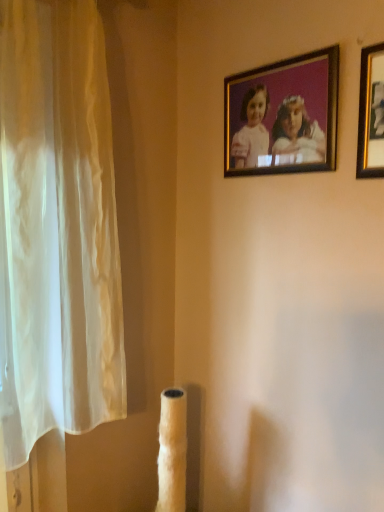
Question: Is gold-framed photo at upper center, the first picture frame when ordered from left to right, looking in the opposite direction of gold-framed picture at upper right, which ranks as the 2th picture frame in back-to-front order?

Choices:
 (A) yes
 (B) no

Answer: (B)

Question: Is gold-framed photo at upper center, the first picture frame when ordered from left to right, shorter than gold-framed picture at upper right, which is counted as the 1th picture frame, starting from the front?

Choices:
 (A) yes
 (B) no

Answer: (A)

Question: Considering the relative positions of gold-framed photo at upper center, the first picture frame when ordered from left to right, and gold-framed picture at upper right, acting as the first picture frame starting from the right, in the image provided, is gold-framed photo at upper center, the first picture frame when ordered from left to right, behind gold-framed picture at upper right, acting as the first picture frame starting from the right,?

Choices:
 (A) yes
 (B) no

Answer: (A)

Question: From the image's perspective, is gold-framed photo at upper center, marked as the second picture frame in a front-to-back arrangement, on gold-framed picture at upper right, which ranks as the 2th picture frame in back-to-front order?

Choices:
 (A) yes
 (B) no

Answer: (A)

Question: Does gold-framed photo at upper center, the 2th picture frame from the right, have a larger size compared to gold-framed picture at upper right, which appears as the 2th picture frame when viewed from the left?

Choices:
 (A) no
 (B) yes

Answer: (B)

Question: From the image's perspective, is gold-framed photo at upper center, marked as the second picture frame in a front-to-back arrangement, located beneath gold-framed picture at upper right, which ranks as the 2th picture frame in back-to-front order?

Choices:
 (A) yes
 (B) no

Answer: (B)

Question: Is gold-framed picture at upper right, which ranks as the 2th picture frame in back-to-front order, next to gold-framed photo at upper center, marked as the second picture frame in a front-to-back arrangement?

Choices:
 (A) yes
 (B) no

Answer: (B)

Question: Does gold-framed picture at upper right, acting as the first picture frame starting from the right, have a larger size compared to gold-framed photo at upper center, the 2th picture frame from the right?

Choices:
 (A) yes
 (B) no

Answer: (B)

Question: Considering the relative positions of gold-framed picture at upper right, acting as the first picture frame starting from the right, and gold-framed photo at upper center, the 2th picture frame from the right, in the image provided, is gold-framed picture at upper right, acting as the first picture frame starting from the right, in front of gold-framed photo at upper center, the 2th picture frame from the right,?

Choices:
 (A) yes
 (B) no

Answer: (A)

Question: Is gold-framed picture at upper right, which is counted as the 1th picture frame, starting from the front, smaller than gold-framed photo at upper center, marked as the second picture frame in a front-to-back arrangement?

Choices:
 (A) no
 (B) yes

Answer: (B)

Question: Is gold-framed picture at upper right, which appears as the 2th picture frame when viewed from the left, far from gold-framed photo at upper center, the first picture frame when ordered from left to right?

Choices:
 (A) yes
 (B) no

Answer: (B)

Question: From the image's perspective, is gold-framed picture at upper right, which ranks as the 2th picture frame in back-to-front order, under gold-framed photo at upper center, marked as the second picture frame in a front-to-back arrangement?

Choices:
 (A) no
 (B) yes

Answer: (B)

Question: In terms of size, does gold-framed photo at upper center, which is the first picture frame in back-to-front order, appear bigger or smaller than gold-framed picture at upper right, which is counted as the 1th picture frame, starting from the front?

Choices:
 (A) small
 (B) big

Answer: (B)